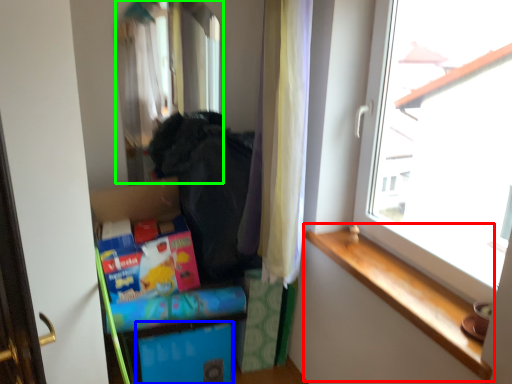
Question: Based on their relative distances, which object is nearer to window sill (highlighted by a red box)? Choose from storage box (highlighted by a blue box) and mirror (highlighted by a green box).

Choices:
 (A) storage box
 (B) mirror

Answer: (A)